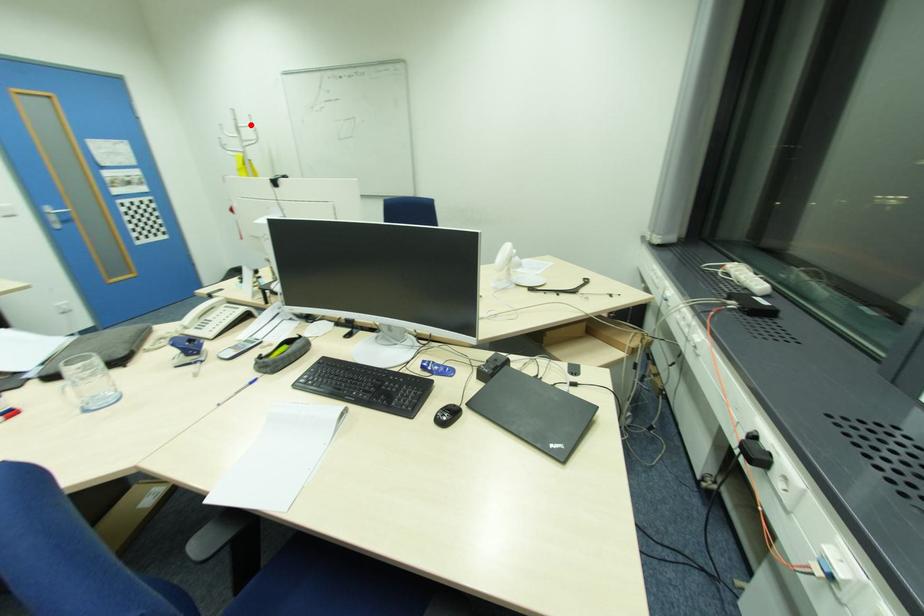
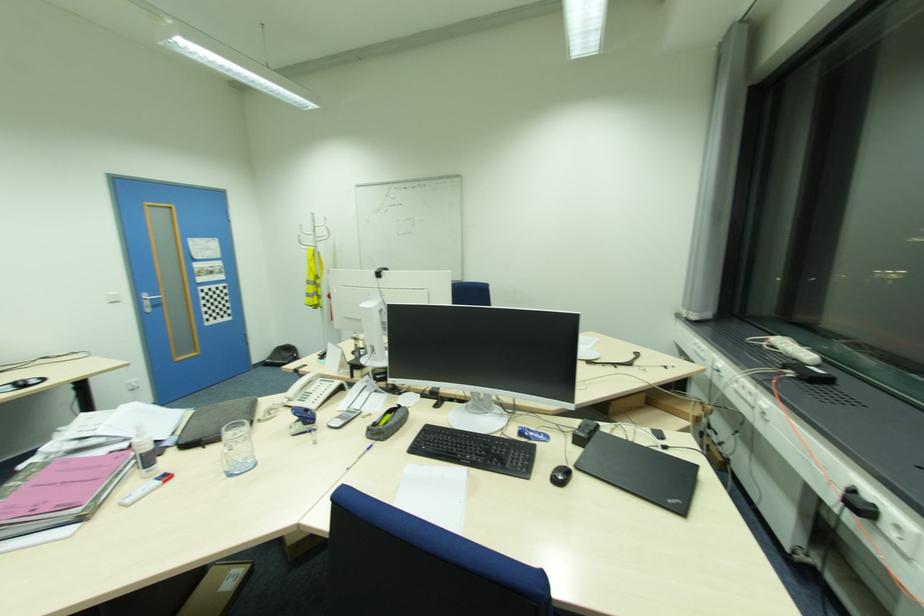
Locate, in the second image, the point that corresponds to the highlighted location in the first image.

(330, 225)